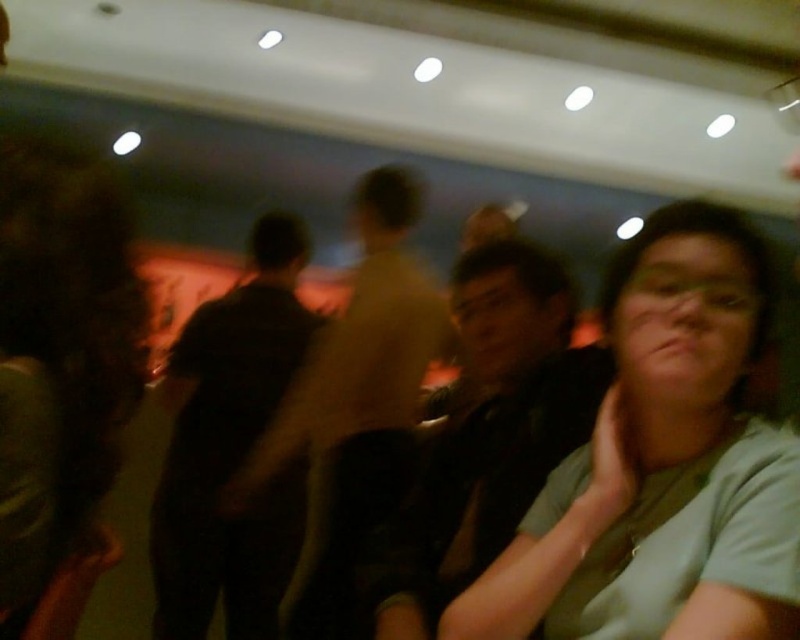
Consider the image. Does dark brown shirt at center have a smaller size compared to white matte hand at lower right?

Actually, dark brown shirt at center might be larger than white matte hand at lower right.

Is point (376, 257) positioned in front of point (616, 419)?

No, (376, 257) is behind (616, 419).

Is point (404, 392) closer to viewer compared to point (602, 516)?

No.

The width and height of the screenshot is (800, 640). I want to click on dark brown shirt at center, so click(356, 403).

Based on the photo, which is more to the left, matte black shirt at center or white matte hand at lower right?

From the viewer's perspective, matte black shirt at center appears more on the left side.

Measure the distance between point (556, 316) and camera.

Point (556, 316) and camera are 1.39 meters apart.

Where is `matte black shirt at center`? This screenshot has height=640, width=800. matte black shirt at center is located at coordinates (490, 433).

Which is in front, point (628, 374) or point (616, 397)?

Point (628, 374)

From the picture: Is light blue fabric at center taller than white matte hand at lower right?

Correct, light blue fabric at center is much taller as white matte hand at lower right.

At what (x,y) coordinates should I click in order to perform the action: click on light blue fabric at center. Please return your answer as a coordinate pair (x, y). The height and width of the screenshot is (640, 800). Looking at the image, I should click on (666, 465).